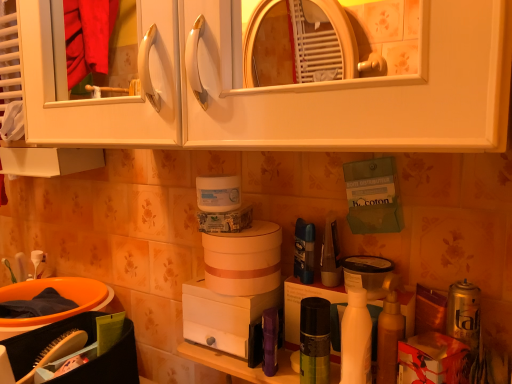
Question: From a real-world perspective, relative to green matte spray can at center, which ranks as the 2th toiletry in left-to-right order, is white matte bottle at center right vertically above or below?

Choices:
 (A) above
 (B) below

Answer: (A)

Question: Does point (339, 379) appear closer or farther from the camera than point (301, 349)?

Choices:
 (A) closer
 (B) farther

Answer: (A)

Question: Which object is the closest to the orange plastic basin at lower left?

Choices:
 (A) white matte cabinet at upper center
 (B) translucent plastic mouthwash at center right
 (C) white matte bottle at center right
 (D) purple fabric pouch at center, which appears as the 1th toiletry when viewed from the left
 (E) green matte spray can at center, which ranks as the 2th toiletry in left-to-right order

Answer: (A)

Question: Estimate the real-world distances between objects in this image. Which object is farther from the white matte cabinet at upper center?

Choices:
 (A) translucent plastic mouthwash at center right
 (B) purple fabric pouch at center, which is the second toiletry from right to left
 (C) white matte bottle at center right
 (D) green matte spray can at center, which ranks as the 2th toiletry in left-to-right order
 (E) orange plastic basin at lower left

Answer: (E)